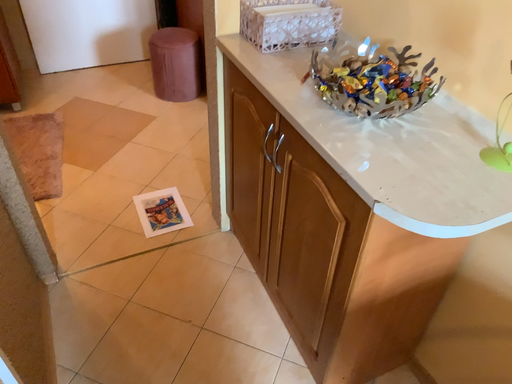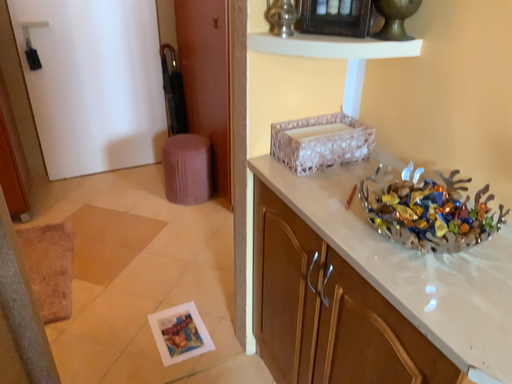
Question: How did the camera likely rotate when shooting the video?

Choices:
 (A) rotated upward
 (B) rotated downward

Answer: (A)